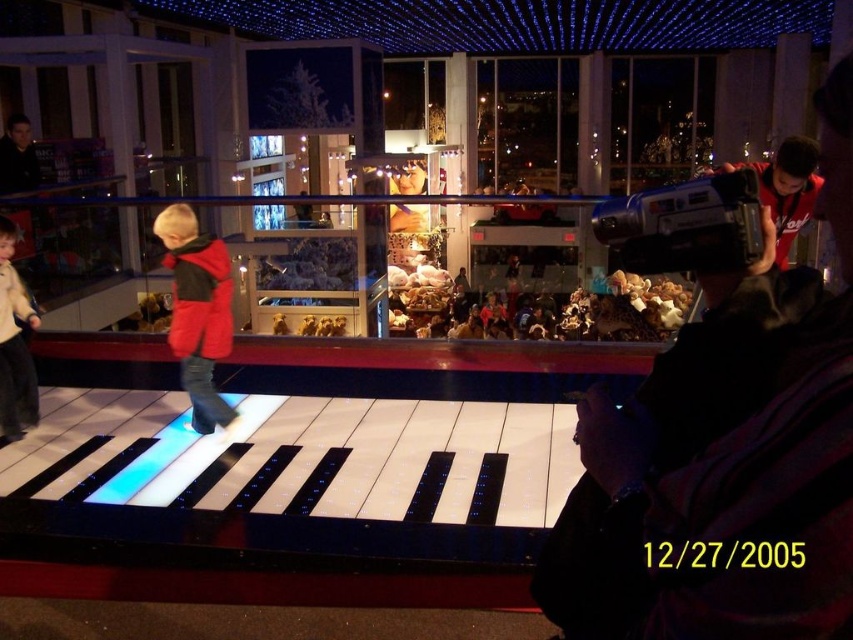
Based on the photo, you are standing at the glass railing and want to take a photo of the red matte jacket at center without the matte black camera at right blocking your view. Is this possible?

The matte black camera at right is closer to the viewer than the red matte jacket at center, so it will block the view of the red matte jacket at center. Move to a position where the matte black camera at right is not between you and the red matte jacket at center.

You are a photographer trying to capture a photo of the red matte jacket at center from the matte black camera at right. Given that the minimum focusing distance for your camera is 10 feet, will you be able to take a clear photo?

The matte black camera at right is 11.41 feet from the red matte jacket at center, which is beyond the minimum focusing distance of 10 feet. Therefore, you can take a clear photo.

You are a photographer at the event and need to capture both the red matte jacket at center and the light beige sweater at left in a single frame. Considering their sizes, which object should you focus on to ensure both fit in the camera view?

The red matte jacket at center is wider than the light beige sweater at left. To ensure both fit in the camera view, focus on the red matte jacket at center as it occupies more space, allowing the smaller light beige sweater at left to be included within the frame.